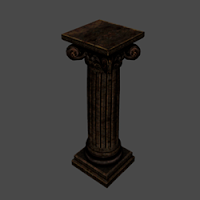
This screenshot has width=200, height=200. In order to click on pillar in this screenshot , I will do `click(105, 116)`.